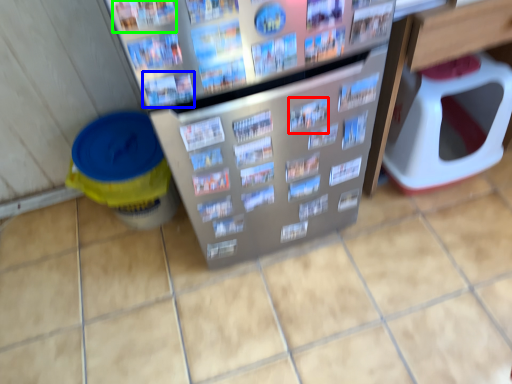
Question: Which object is the closest to the magazine (highlighted by a red box)? Choose among these: magazine (highlighted by a blue box) or magazine (highlighted by a green box).

Choices:
 (A) magazine
 (B) magazine

Answer: (A)